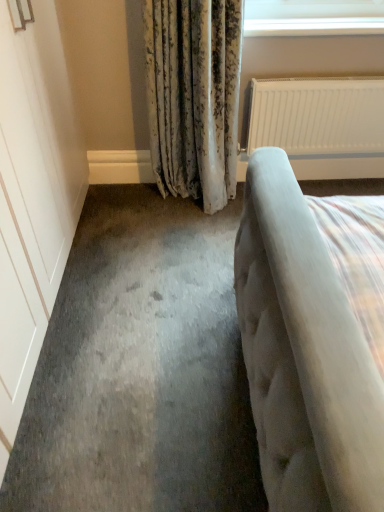
This screenshot has height=512, width=384. Find the location of `empty space that is ontop of white textured radiator at upper right (from a real-world perspective)`. empty space that is ontop of white textured radiator at upper right (from a real-world perspective) is located at coordinates (334, 73).